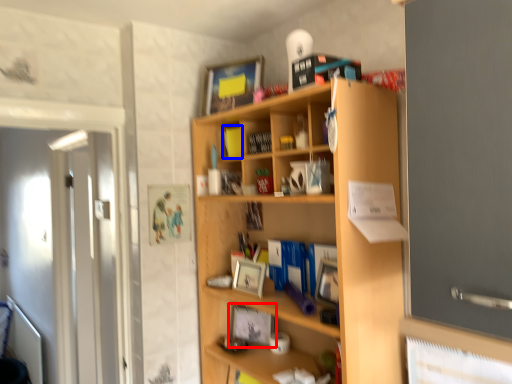
Question: Among these objects, which one is nearest to the camera, picture frame (highlighted by a red box) or book (highlighted by a blue box)?

Choices:
 (A) picture frame
 (B) book

Answer: (A)